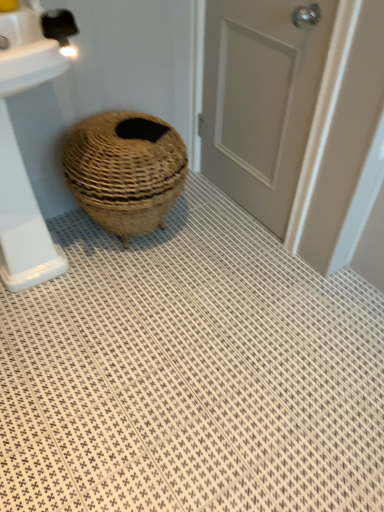
I want to click on vacant point above white textured bath mat at center (from a real-world perspective), so click(183, 333).